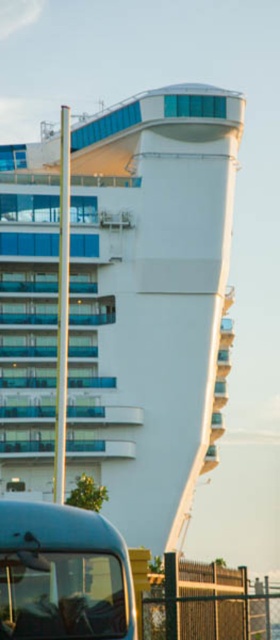
You are standing at the base of the modern building and looking upward. There are two points marked on the building facade. One is at coordinate point [75,461] and the other at point [63,637]. Which point is closer to your line of sight when you look straight ahead?

Point [63,637] is closer to your line of sight because it is in front of point [75,461].

You are a photographer planning to capture both the white glossy cruise ship at center and the metallic blue tour bus at lower left in a single frame. Given their height difference, which object will appear larger in the photo?

The white glossy cruise ship at center will appear larger in the photo because it is much taller than the metallic blue tour bus at lower left.

You are planning to take a photo of the white glossy cruise ship at center and the metallic blue tour bus at lower left. Which object should you focus on if you want to capture the wider subject in the scene?

The white glossy cruise ship at center might be wider than metallic blue tour bus at lower left, so you should focus on the white glossy cruise ship at center to capture the wider subject.